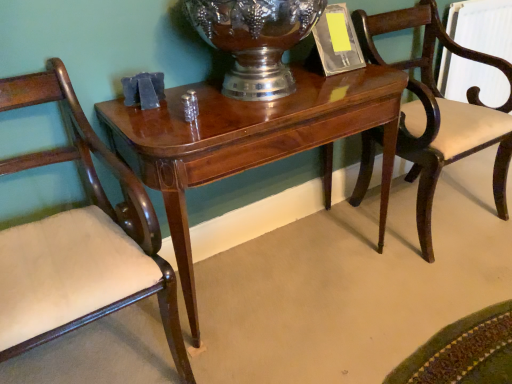
Question: Does shiny wood table at center have a lesser height compared to mahogany wood chair at left, arranged as the 2th chair when viewed from the right?

Choices:
 (A) yes
 (B) no

Answer: (A)

Question: Is shiny wood table at center placed right next to mahogany wood chair at left, arranged as the 2th chair when viewed from the right?

Choices:
 (A) no
 (B) yes

Answer: (A)

Question: From the image's perspective, is shiny wood table at center above mahogany wood chair at left, arranged as the first chair when viewed from the left?

Choices:
 (A) no
 (B) yes

Answer: (B)

Question: Is mahogany wood chair at left, arranged as the 2th chair when viewed from the right, located within shiny wood table at center?

Choices:
 (A) yes
 (B) no

Answer: (B)

Question: From the image's perspective, is shiny wood table at center below mahogany wood chair at left, arranged as the 2th chair when viewed from the right?

Choices:
 (A) yes
 (B) no

Answer: (B)

Question: Considering the relative sizes of shiny wood table at center and mahogany wood chair at left, arranged as the 2th chair when viewed from the right, in the image provided, is shiny wood table at center smaller than mahogany wood chair at left, arranged as the 2th chair when viewed from the right,?

Choices:
 (A) yes
 (B) no

Answer: (B)

Question: Considering the relative sizes of mahogany wood chair at right, placed as the 2th chair when sorted from left to right, and shiny wood table at center in the image provided, is mahogany wood chair at right, placed as the 2th chair when sorted from left to right, smaller than shiny wood table at center?

Choices:
 (A) yes
 (B) no

Answer: (A)

Question: Is mahogany wood chair at right, the first chair when ordered from right to left, to the right of shiny wood table at center from the viewer's perspective?

Choices:
 (A) no
 (B) yes

Answer: (B)

Question: Is mahogany wood chair at right, the first chair when ordered from right to left, in front of shiny wood table at center?

Choices:
 (A) yes
 (B) no

Answer: (B)

Question: Can you confirm if mahogany wood chair at right, placed as the 2th chair when sorted from left to right, is taller than shiny wood table at center?

Choices:
 (A) yes
 (B) no

Answer: (A)

Question: Is the depth of mahogany wood chair at right, placed as the 2th chair when sorted from left to right, greater than that of shiny wood table at center?

Choices:
 (A) no
 (B) yes

Answer: (B)

Question: Is mahogany wood chair at right, placed as the 2th chair when sorted from left to right, facing towards shiny wood table at center?

Choices:
 (A) yes
 (B) no

Answer: (B)

Question: From the image's perspective, is shiny silver vase at center below shiny wood table at center?

Choices:
 (A) yes
 (B) no

Answer: (B)